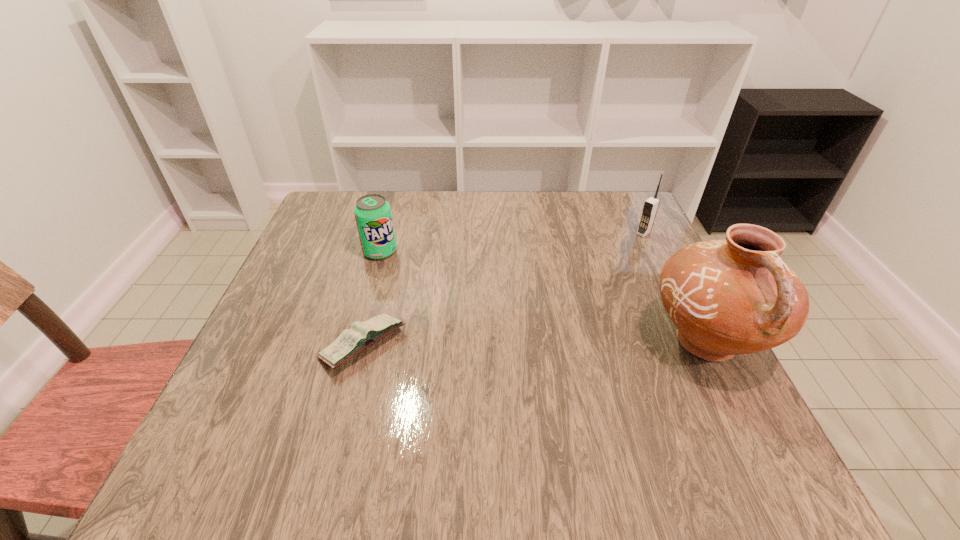
You are a GUI agent. You are given a task and a screenshot of the screen. Output one action in this format:
    pyautogui.click(x=<x>, y=<y>)
    Task: Click on the diary
    
    Given the screenshot: What is the action you would take?
    [361, 335]

Identify the location of pottery. (730, 297).

You are a GUI agent. You are given a task and a screenshot of the screen. Output one action in this format:
    pyautogui.click(x=<x>, y=<y>)
    Task: Click on the cellular telephone
    
    Given the screenshot: What is the action you would take?
    pyautogui.click(x=651, y=205)

This screenshot has width=960, height=540. Identify the location of the third tallest object. (372, 212).

Locate an element on the screen. the second farthest object is located at coordinates (372, 212).

I want to click on vacant space located on the back of the diary, so click(376, 296).

This screenshot has height=540, width=960. I want to click on vacant space located 0.070m on the side of the tallest object with the handle, so click(751, 429).

Locate an element on the screen. The height and width of the screenshot is (540, 960). vacant region located on the front-facing side of the cellular telephone is located at coordinates (611, 261).

Find the location of a particular element. free space located 0.330m on the front-facing side of the cellular telephone is located at coordinates (564, 299).

You are a GUI agent. You are given a task and a screenshot of the screen. Output one action in this format:
    pyautogui.click(x=<x>, y=<y>)
    Task: Click on the vacant space located on the front-facing side of the cellular telephone
    Image resolution: width=960 pixels, height=540 pixels.
    Given the screenshot: What is the action you would take?
    pyautogui.click(x=607, y=264)